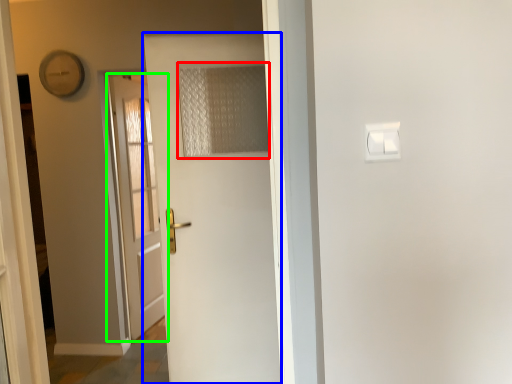
Question: Based on their relative distances, which object is farther from curtain (highlighted by a red box)? Choose from door (highlighted by a blue box) and door (highlighted by a green box).

Choices:
 (A) door
 (B) door

Answer: (B)